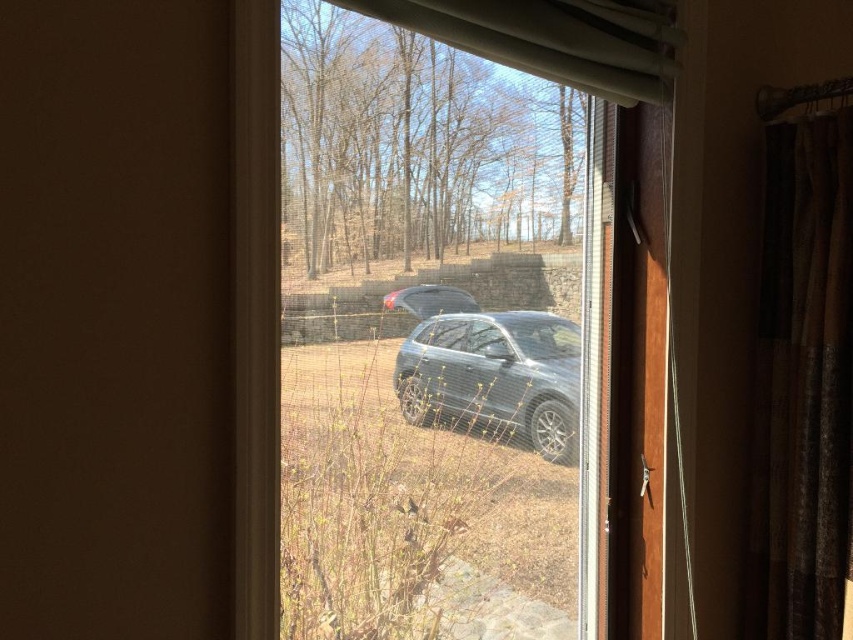
Question: Which object is positioned farthest from the satin black suv at center?

Choices:
 (A) white sheer curtain at upper center
 (B) clear glass window at center

Answer: (A)

Question: Which point is farther to the camera?

Choices:
 (A) (815, 340)
 (B) (564, 33)
 (C) (447, 209)

Answer: (A)

Question: Can you confirm if brown textured curtain at right is positioned to the left of white sheer curtain at upper center?

Choices:
 (A) yes
 (B) no

Answer: (B)

Question: Does clear glass window at center appear over white sheer curtain at upper center?

Choices:
 (A) no
 (B) yes

Answer: (A)

Question: Is clear glass window at center in front of brown textured curtain at right?

Choices:
 (A) no
 (B) yes

Answer: (B)

Question: Which of these objects is positioned closest to the clear glass window at center?

Choices:
 (A) brown textured curtain at right
 (B) satin black suv at center

Answer: (B)